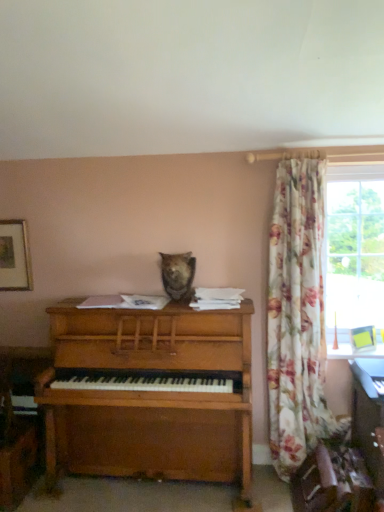
Question: Is fuzzy brown bear at center touching wooden desk at lower right?

Choices:
 (A) yes
 (B) no

Answer: (B)

Question: Would you say wooden desk at lower right is part of fuzzy brown bear at center's contents?

Choices:
 (A) yes
 (B) no

Answer: (B)

Question: Can you confirm if fuzzy brown bear at center is taller than wooden desk at lower right?

Choices:
 (A) no
 (B) yes

Answer: (A)

Question: Is fuzzy brown bear at center facing away from wooden desk at lower right?

Choices:
 (A) no
 (B) yes

Answer: (A)

Question: Does fuzzy brown bear at center appear on the right side of wooden desk at lower right?

Choices:
 (A) no
 (B) yes

Answer: (A)

Question: Would you say wooden framed picture at upper left is inside or outside floral fabric curtain at right?

Choices:
 (A) outside
 (B) inside

Answer: (A)

Question: Considering their positions, is wooden framed picture at upper left located in front of or behind floral fabric curtain at right?

Choices:
 (A) behind
 (B) front

Answer: (A)

Question: Considering the positions of point (1, 227) and point (291, 266), is point (1, 227) closer or farther from the camera than point (291, 266)?

Choices:
 (A) farther
 (B) closer

Answer: (A)

Question: Is wooden framed picture at upper left wider or thinner than floral fabric curtain at right?

Choices:
 (A) wide
 (B) thin

Answer: (B)

Question: Is point (173, 266) closer or farther from the camera than point (23, 269)?

Choices:
 (A) closer
 (B) farther

Answer: (A)

Question: From the image's perspective, is fuzzy brown bear at center above or below wooden framed picture at upper left?

Choices:
 (A) below
 (B) above

Answer: (A)

Question: Is fuzzy brown bear at center wider or thinner than wooden framed picture at upper left?

Choices:
 (A) wide
 (B) thin

Answer: (A)

Question: Considering their positions, is fuzzy brown bear at center located in front of or behind wooden framed picture at upper left?

Choices:
 (A) front
 (B) behind

Answer: (A)

Question: From a real-world perspective, relative to floral fabric curtain at right, is wooden desk at lower right vertically above or below?

Choices:
 (A) below
 (B) above

Answer: (A)

Question: From the image's perspective, is wooden desk at lower right above or below floral fabric curtain at right?

Choices:
 (A) below
 (B) above

Answer: (A)